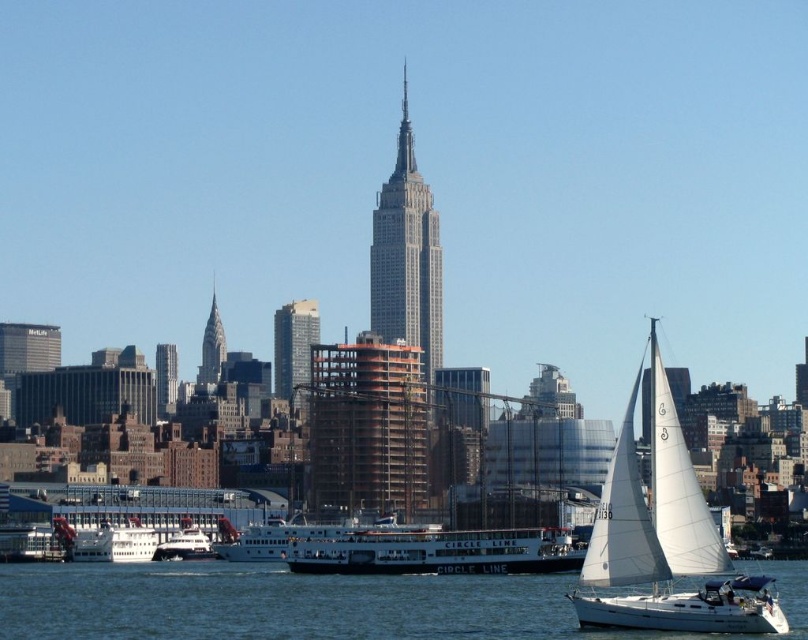
What do you see at coordinates (314, 604) in the screenshot? This screenshot has width=808, height=640. I see `clear blue water at lower center` at bounding box center [314, 604].

Does clear blue water at lower center have a greater width compared to white sailboat at right?

Yes.

Is point (66, 600) less distant than point (701, 513)?

No, (66, 600) is further to viewer.

Identify the location of clear blue water at lower center. (314, 604).

How much distance is there between white sailboat at right and white matte ferry at center?

white sailboat at right is 265.70 feet from white matte ferry at center.

Who is more forward, (617, 545) or (305, 536)?

Point (305, 536) is in front.

Find the location of a particular element. white sailboat at right is located at coordinates (663, 538).

Looking at this image, between white matte boat at center and white matte ferry at center, which one is positioned higher?

white matte ferry at center is above.

Is the position of white matte boat at center more distant than that of white matte ferry at center?

No, white matte boat at center is in front of white matte ferry at center.

I want to click on white matte boat at center, so click(x=436, y=552).